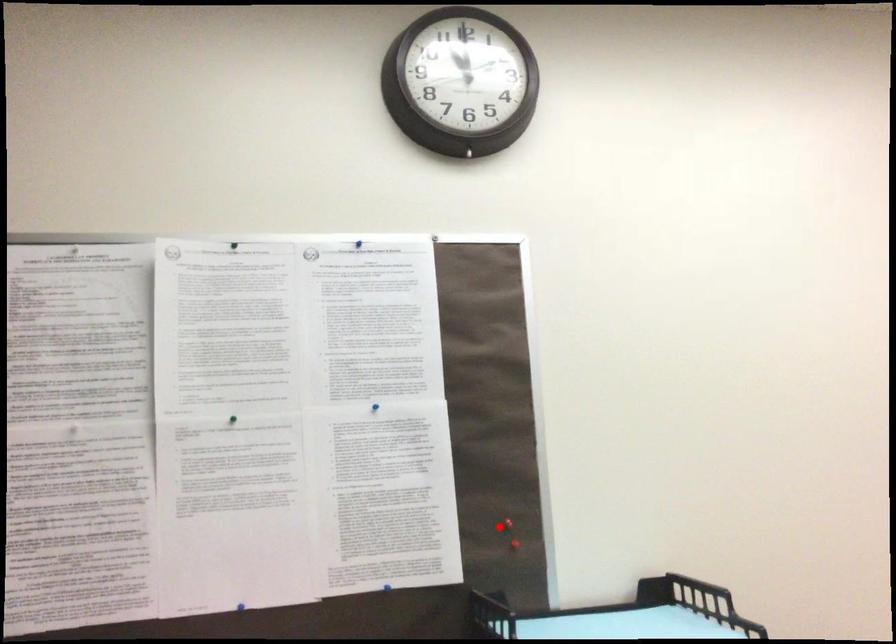
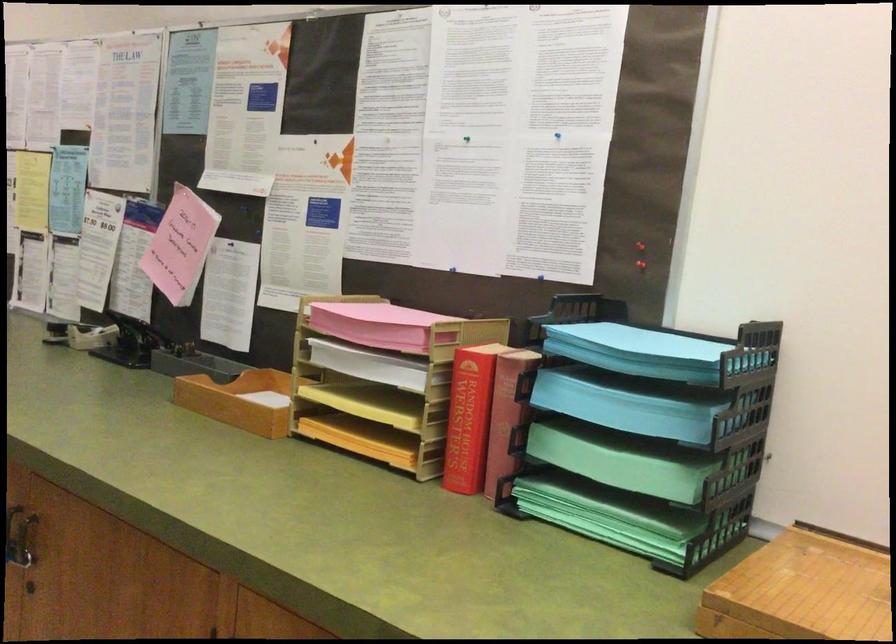
In the second image, find the point that corresponds to the highlighted location in the first image.

(640, 245)